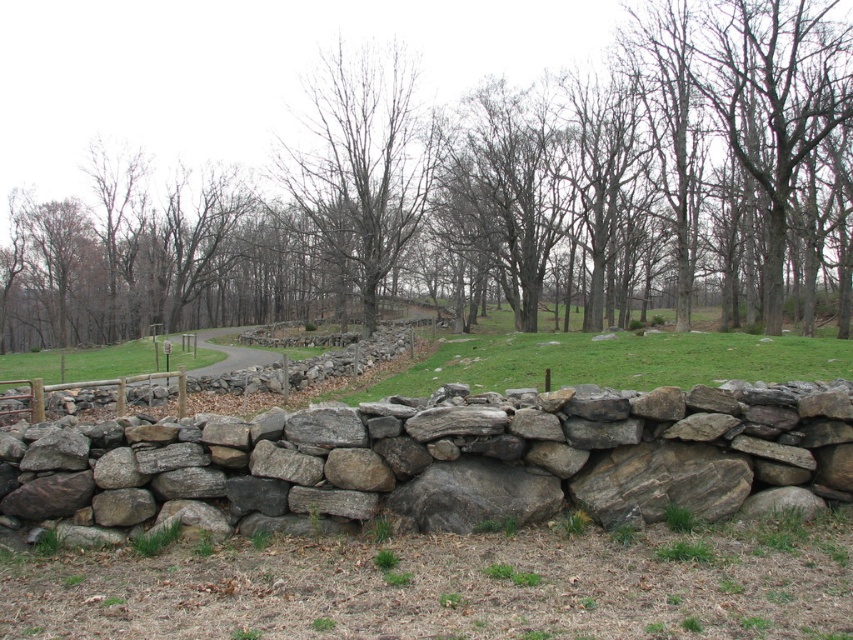
Who is lower down, natural stone wall at center or bare wood tree at center?

Positioned lower is natural stone wall at center.

Between point (701, 509) and point (325, 99), which one is positioned in front?

Point (701, 509) is in front.

Find the location of `natural stone wall at center`. natural stone wall at center is located at coordinates (440, 460).

Is point (633, 248) in front of point (618, 458)?

No, (633, 248) is behind (618, 458).

Who is positioned more to the left, smooth bark tree at center or natural stone wall at center?

smooth bark tree at center

Does point (767, 232) come closer to viewer compared to point (820, 419)?

No, (767, 232) is behind (820, 419).

Locate an element on the screen. This screenshot has height=640, width=853. smooth bark tree at center is located at coordinates (482, 192).

What do you see at coordinates (482, 192) in the screenshot?
I see `smooth bark tree at center` at bounding box center [482, 192].

Who is positioned more to the left, smooth bark tree at center or bare wood tree at center?

Positioned to the left is smooth bark tree at center.

Between point (344, 182) and point (312, 84), which one is positioned in front?

Point (344, 182) is more forward.

In order to click on smooth bark tree at center in this screenshot , I will do `click(482, 192)`.